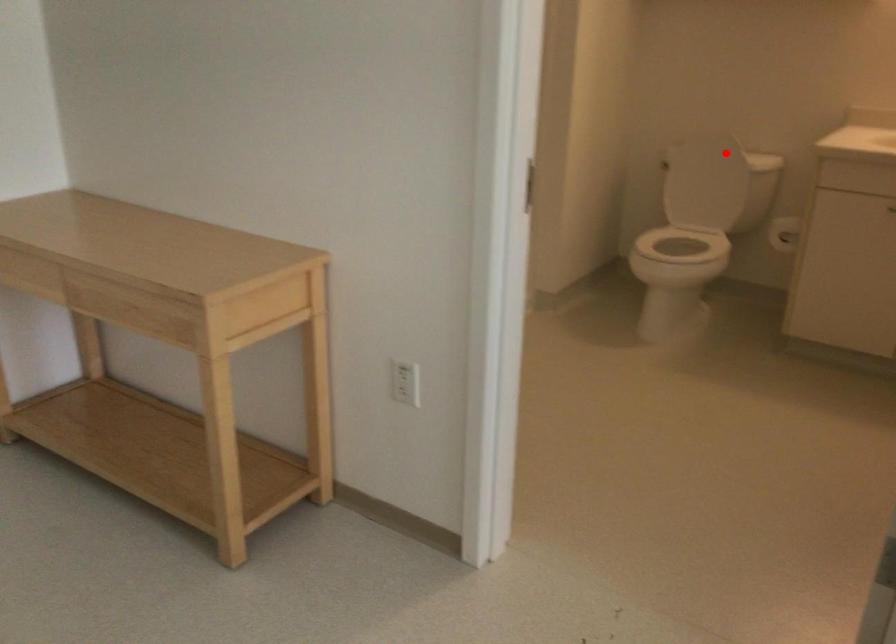
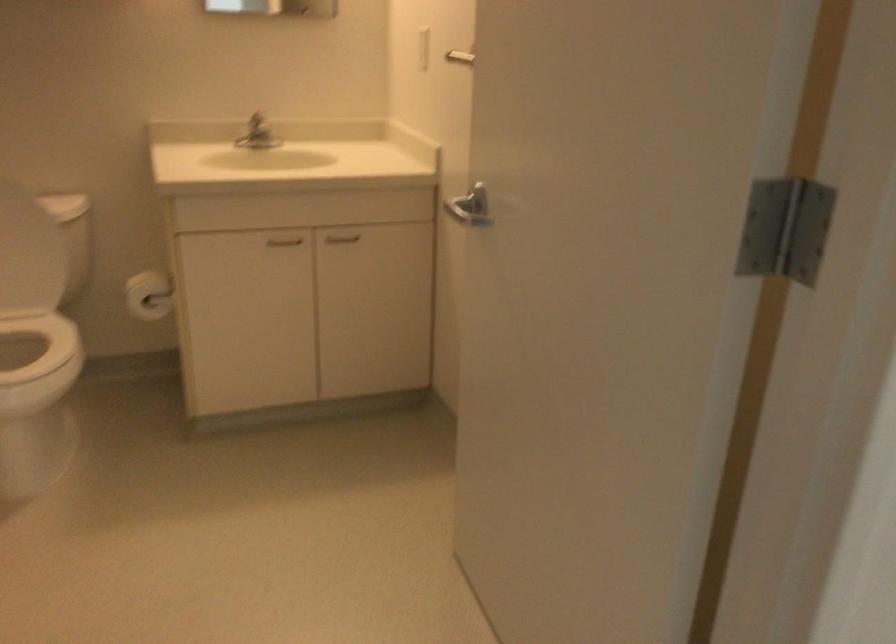
Question: I am providing you with two images of the same scene from different viewpoints. Image1 has a red point marked. In image2, the corresponding 3D location appears at what relative position? Reply with the corresponding letter.

Choices:
 (A) Closer
 (B) Farther

Answer: (A)